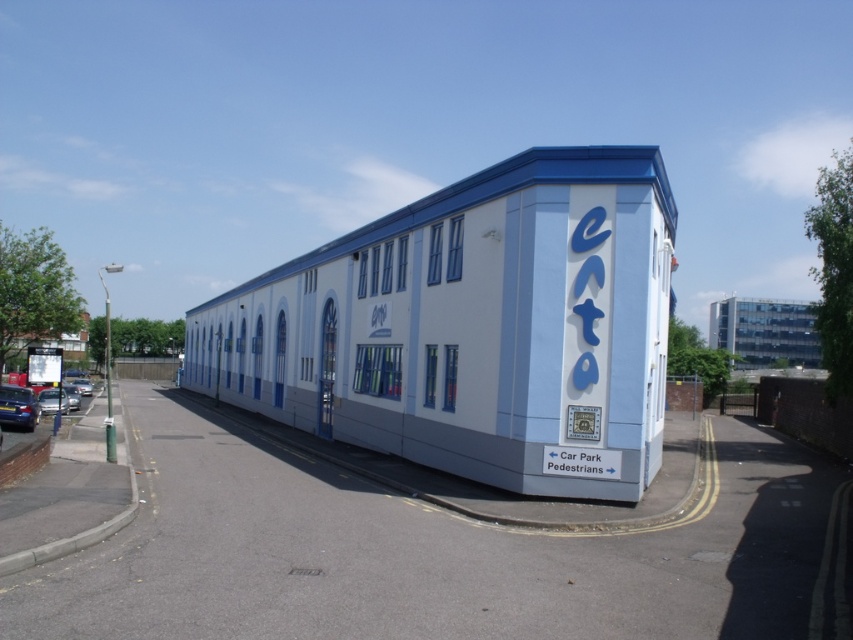
Can you confirm if shiny metallic car at lower left is taller than shiny silver car at lower left?

Incorrect, shiny metallic car at lower left's height is not larger of shiny silver car at lower left's.

In the scene shown: Between shiny metallic car at lower left and shiny silver car at lower left, which one is positioned higher?

Positioned higher is shiny metallic car at lower left.

Is point (38, 412) positioned behind point (54, 387)?

That is False.

Where is `shiny metallic car at lower left`? The width and height of the screenshot is (853, 640). shiny metallic car at lower left is located at coordinates (18, 406).

Can you confirm if shiny metallic car at lower left is bigger than shiny silver car at center?

No.

Measure the distance between shiny metallic car at lower left and camera.

The distance of shiny metallic car at lower left from camera is 24.18 meters.

Who is more forward, (16, 404) or (78, 385)?

Positioned in front is point (16, 404).

The width and height of the screenshot is (853, 640). What are the coordinates of `shiny metallic car at lower left` in the screenshot? It's located at (18, 406).

How far apart are light blue painted metal building at center and silver metallic car at left?

The distance of light blue painted metal building at center from silver metallic car at left is 57.35 feet.

Who is shorter, light blue painted metal building at center or silver metallic car at left?

Standing shorter between the two is silver metallic car at left.

Find the location of a particular element. light blue painted metal building at center is located at coordinates (474, 326).